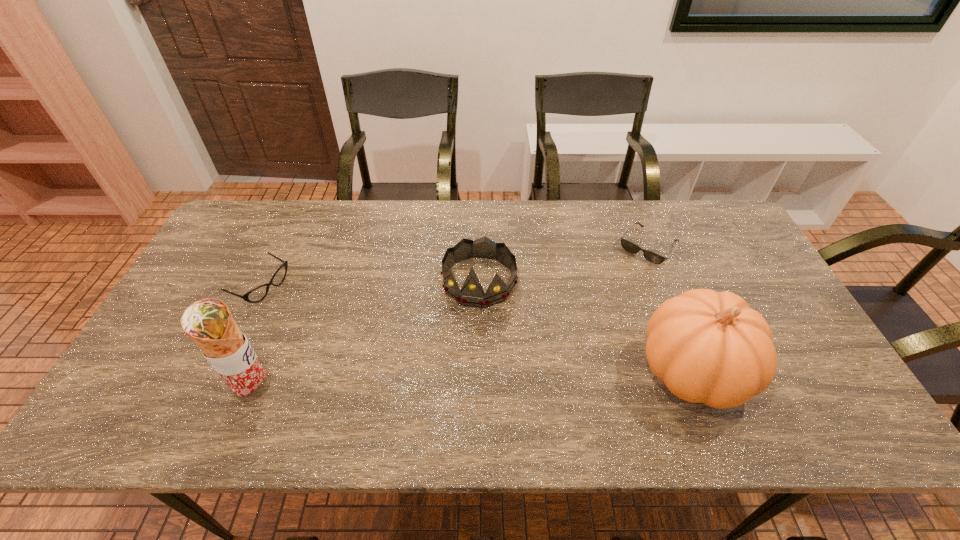
You are a GUI agent. You are given a task and a screenshot of the screen. Output one action in this format:
    pyautogui.click(x=<x>, y=<y>)
    Task: Click on the object that is at the left edge
    The image size is (960, 540).
    Given the screenshot: What is the action you would take?
    [x=257, y=294]

The height and width of the screenshot is (540, 960). What are the coordinates of `vacant region at the far edge of the desktop` in the screenshot? It's located at (400, 202).

The image size is (960, 540). Find the location of `free location at the near edge`. free location at the near edge is located at coordinates (494, 369).

In the image, there is a desktop. What are the coordinates of `vacant space at the left edge` in the screenshot? It's located at (219, 268).

At what (x,y) coordinates should I click in order to perform the action: click on vacant space at the right edge of the desktop. Please return your answer as a coordinate pair (x, y). The height and width of the screenshot is (540, 960). Looking at the image, I should click on (736, 279).

Where is `free space at the far left corner of the desktop`? This screenshot has height=540, width=960. free space at the far left corner of the desktop is located at coordinates (x=269, y=207).

In the image, there is a desktop. At what (x,y) coordinates should I click in order to perform the action: click on vacant space at the far right corner. Please return your answer as a coordinate pair (x, y). The height and width of the screenshot is (540, 960). Looking at the image, I should click on (699, 211).

This screenshot has width=960, height=540. I want to click on vacant area that lies between the burrito and the spectacles, so click(x=258, y=337).

Locate an element on the screen. vacant area that lies between the pumpkin and the third object from left to right is located at coordinates (586, 326).

Identify the location of empty location between the shortest object and the fourth tallest object. (455, 267).